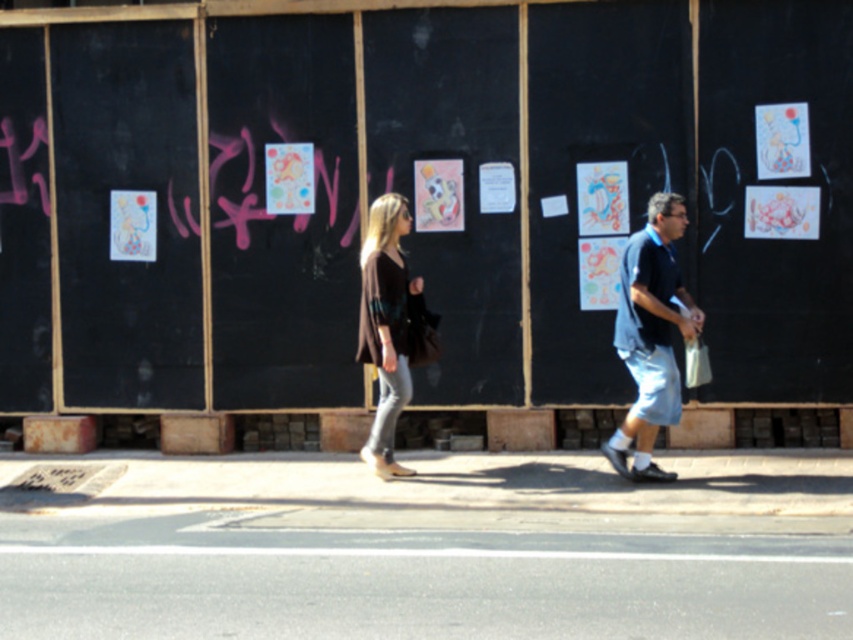
Question: Where is blue cotton shirt at center located in relation to matte brown sweater at center in the image?

Choices:
 (A) below
 (B) above

Answer: (B)

Question: Which object is the farthest from the black matte bulletin board at center?

Choices:
 (A) gray asphalt at lower center
 (B) matte brown sweater at center
 (C) brown textured sweater at center
 (D) blue cotton shirt at center

Answer: (A)

Question: Which point is closer to the camera?

Choices:
 (A) blue cotton shirt at center
 (B) black matte bulletin board at center

Answer: (A)

Question: Is black matte bulletin board at center to the left of gray asphalt at lower center from the viewer's perspective?

Choices:
 (A) no
 (B) yes

Answer: (B)

Question: Does gray asphalt at lower center come behind matte brown sweater at center?

Choices:
 (A) no
 (B) yes

Answer: (A)

Question: Which point is closer to the camera taking this photo?

Choices:
 (A) (242, 552)
 (B) (625, 340)

Answer: (A)